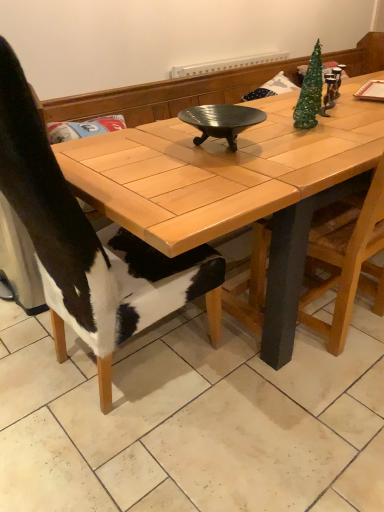
At what (x,y) coordinates should I click in order to perform the action: click on spots to the right of cowhide at left, marked as the 2th chair in a right-to-left arrangement. Please return your answer as a coordinate pair (x, y). This screenshot has height=512, width=384. Looking at the image, I should click on (250, 386).